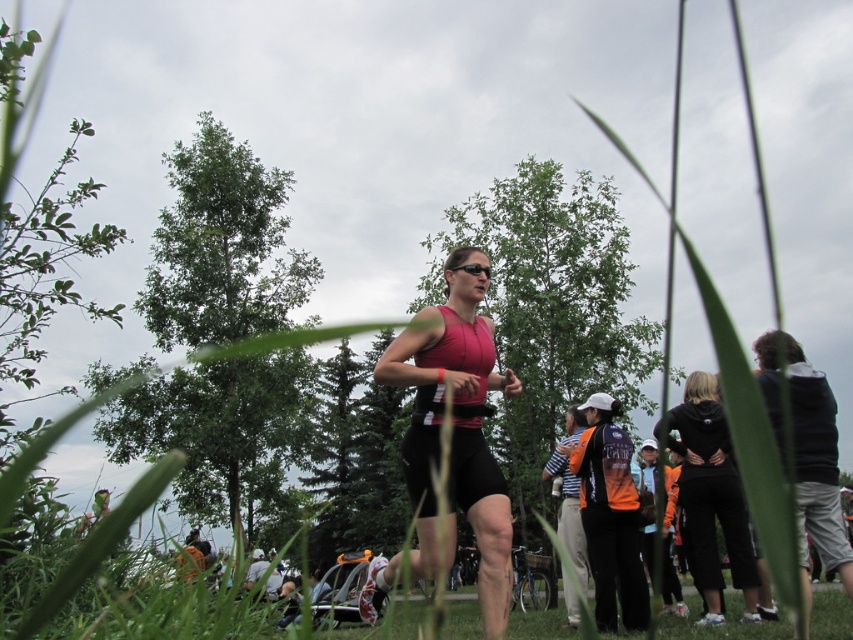
Question: Does matte pink tank top at center have a smaller size compared to black matte hoodie at lower right?

Choices:
 (A) yes
 (B) no

Answer: (B)

Question: Is matte pink tank top at center thinner than black matte hoodie at lower right?

Choices:
 (A) no
 (B) yes

Answer: (A)

Question: Can you confirm if matte pink tank top at center is smaller than black matte hoodie at lower right?

Choices:
 (A) no
 (B) yes

Answer: (A)

Question: Among these objects, which one is farthest from the camera?

Choices:
 (A) black matte hoodie at lower right
 (B) matte pink tank top at center

Answer: (A)